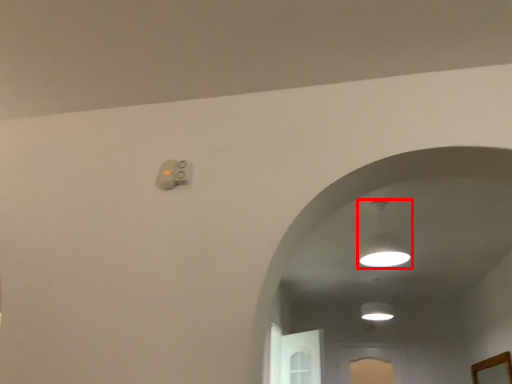
Question: Observing the image, what is the correct spatial positioning of lamp (annotated by the red box) in reference to mirror?

Choices:
 (A) left
 (B) right

Answer: (A)